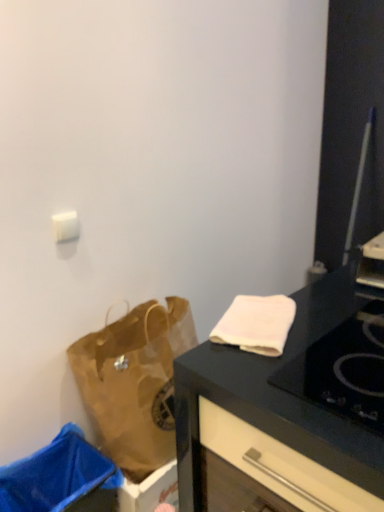
What is the approximate height of black glass gas stove at upper right?

It is 1.97 inches.

The width and height of the screenshot is (384, 512). What do you see at coordinates (56, 475) in the screenshot?
I see `blue plastic trash bin at lower left` at bounding box center [56, 475].

At what (x,y) coordinates should I click in order to perform the action: click on white soft towel at upper right. Please return your answer as a coordinate pair (x, y). Looking at the image, I should click on [x=256, y=324].

You are a GUI agent. You are given a task and a screenshot of the screen. Output one action in this format:
    pyautogui.click(x=<x>, y=<y>)
    Task: Click on the black glass gas stove at upper right
    This screenshot has height=512, width=384.
    Given the screenshot: What is the action you would take?
    pyautogui.click(x=343, y=370)

Identify the location of cloth lying on the left of black glass gas stove at upper right. pyautogui.click(x=256, y=324).

Considering the relative sizes of black glass gas stove at upper right and white soft towel at upper right in the image provided, is black glass gas stove at upper right taller than white soft towel at upper right?

No, black glass gas stove at upper right is not taller than white soft towel at upper right.

In the scene shown: Considering the relative sizes of black glass gas stove at upper right and white soft towel at upper right in the image provided, is black glass gas stove at upper right wider than white soft towel at upper right?

Yes.

Are black glass gas stove at upper right and brown paper bag at lower left beside each other?

No, black glass gas stove at upper right is not touching brown paper bag at lower left.

The image size is (384, 512). Find the location of `handbag lying below the black glass gas stove at upper right (from the image's perspective)`. handbag lying below the black glass gas stove at upper right (from the image's perspective) is located at coordinates (135, 382).

Is the depth of black glass gas stove at upper right greater than that of brown paper bag at lower left?

No, the depth of black glass gas stove at upper right is less than that of brown paper bag at lower left.

From the image's perspective, which one is positioned lower, black glass gas stove at upper right or brown paper bag at lower left?

brown paper bag at lower left appears lower in the image.

From the image's perspective, relative to white soft towel at upper right, is brown paper bag at lower left above or below?

brown paper bag at lower left is situated lower than white soft towel at upper right in the image.

Considering the relative sizes of brown paper bag at lower left and white soft towel at upper right in the image provided, is brown paper bag at lower left bigger than white soft towel at upper right?

Correct, brown paper bag at lower left is larger in size than white soft towel at upper right.

Is brown paper bag at lower left oriented away from white soft towel at upper right?

That's not correct — brown paper bag at lower left is not looking away from white soft towel at upper right.

Identify the location of cloth located on the right of brown paper bag at lower left. (256, 324).

How different are the orientations of brown paper bag at lower left and blue plastic trash bin at lower left in degrees?

The angular difference between brown paper bag at lower left and blue plastic trash bin at lower left is 0.00065 degrees.

Could you tell me if brown paper bag at lower left is facing blue plastic trash bin at lower left?

No, brown paper bag at lower left is not oriented towards blue plastic trash bin at lower left.

Considering the sizes of objects brown paper bag at lower left and blue plastic trash bin at lower left in the image provided, who is taller, brown paper bag at lower left or blue plastic trash bin at lower left?

brown paper bag at lower left is taller.

Where is `handbag above the blue plastic trash bin at lower left (from a real-world perspective)`? handbag above the blue plastic trash bin at lower left (from a real-world perspective) is located at coordinates (135, 382).

Is white soft towel at upper right oriented towards brown paper bag at lower left?

No, white soft towel at upper right is not aimed at brown paper bag at lower left.

Find the location of `handbag behind the white soft towel at upper right`. handbag behind the white soft towel at upper right is located at coordinates (135, 382).

From a real-world perspective, is white soft towel at upper right over brown paper bag at lower left?

Yes.

Which is in front, point (22, 506) or point (375, 304)?

The point (375, 304) is closer.

Are blue plastic trash bin at lower left and black glass gas stove at upper right making contact?

blue plastic trash bin at lower left and black glass gas stove at upper right are not in contact.

Is blue plastic trash bin at lower left outside of black glass gas stove at upper right?

That's correct, blue plastic trash bin at lower left is outside of black glass gas stove at upper right.

Consider the image. Considering the relative sizes of blue plastic trash bin at lower left and black glass gas stove at upper right in the image provided, is blue plastic trash bin at lower left wider than black glass gas stove at upper right?

In fact, blue plastic trash bin at lower left might be narrower than black glass gas stove at upper right.

Is blue plastic trash bin at lower left aimed at brown paper bag at lower left?

No, blue plastic trash bin at lower left is not oriented towards brown paper bag at lower left.

Considering the relative positions of blue plastic trash bin at lower left and brown paper bag at lower left in the image provided, is blue plastic trash bin at lower left behind brown paper bag at lower left?

That is False.

Between blue plastic trash bin at lower left and brown paper bag at lower left, which one has smaller size?

blue plastic trash bin at lower left.

Between point (105, 462) and point (94, 369), which one is positioned in front?

The point (105, 462) is more forward.

At what (x,y) coordinates should I click in order to perform the action: click on gas stove directly beneath the white soft towel at upper right (from a real-world perspective). Please return your answer as a coordinate pair (x, y). Image resolution: width=384 pixels, height=512 pixels. Looking at the image, I should click on (343, 370).

Identify the location of gas stove on the right of the brown paper bag at lower left. This screenshot has height=512, width=384. (343, 370).

Considering their positions, is brown paper bag at lower left positioned further to white soft towel at upper right than blue plastic trash bin at lower left?

Based on the image, blue plastic trash bin at lower left appears to be further to white soft towel at upper right.

Considering their positions, is brown paper bag at lower left positioned closer to blue plastic trash bin at lower left than white soft towel at upper right?

brown paper bag at lower left is positioned closer to the anchor blue plastic trash bin at lower left.

From the image, which object appears to be nearer to black glass gas stove at upper right, blue plastic trash bin at lower left or white soft towel at upper right?

white soft towel at upper right.

Looking at the image, which one is located closer to white soft towel at upper right, blue plastic trash bin at lower left or brown paper bag at lower left?

Based on the image, brown paper bag at lower left appears to be nearer to white soft towel at upper right.

When comparing their distances from black glass gas stove at upper right, does blue plastic trash bin at lower left or brown paper bag at lower left seem closer?

Among the two, brown paper bag at lower left is located nearer to black glass gas stove at upper right.

From the image, which object appears to be farther from brown paper bag at lower left, blue plastic trash bin at lower left or white soft towel at upper right?

The object further to brown paper bag at lower left is white soft towel at upper right.

Which object lies further to the anchor point white soft towel at upper right, blue plastic trash bin at lower left or black glass gas stove at upper right?

blue plastic trash bin at lower left lies further to white soft towel at upper right than the other object.

Estimate the real-world distances between objects in this image. Which object is closer to black glass gas stove at upper right, brown paper bag at lower left or white soft towel at upper right?

Based on the image, white soft towel at upper right appears to be nearer to black glass gas stove at upper right.

At what (x,y) coordinates should I click in order to perform the action: click on cloth between brown paper bag at lower left and black glass gas stove at upper right in the horizontal direction. Please return your answer as a coordinate pair (x, y). The image size is (384, 512). Looking at the image, I should click on (256, 324).

In order to click on cloth between blue plastic trash bin at lower left and black glass gas stove at upper right from left to right in this screenshot , I will do `click(256, 324)`.

Locate an element on the screen. Image resolution: width=384 pixels, height=512 pixels. handbag between white soft towel at upper right and blue plastic trash bin at lower left vertically is located at coordinates (135, 382).

The height and width of the screenshot is (512, 384). I want to click on handbag between blue plastic trash bin at lower left and black glass gas stove at upper right, so click(135, 382).